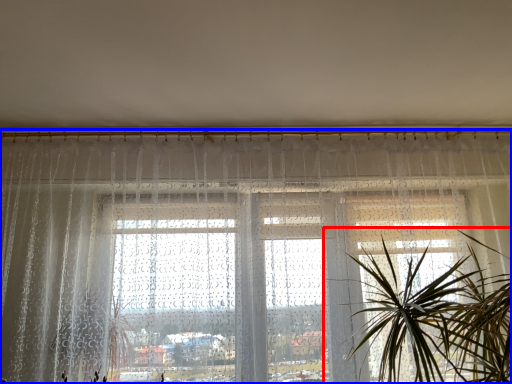
Question: Among these objects, which one is farthest to the camera, houseplant (highlighted by a red box) or window (highlighted by a blue box)?

Choices:
 (A) houseplant
 (B) window

Answer: (B)